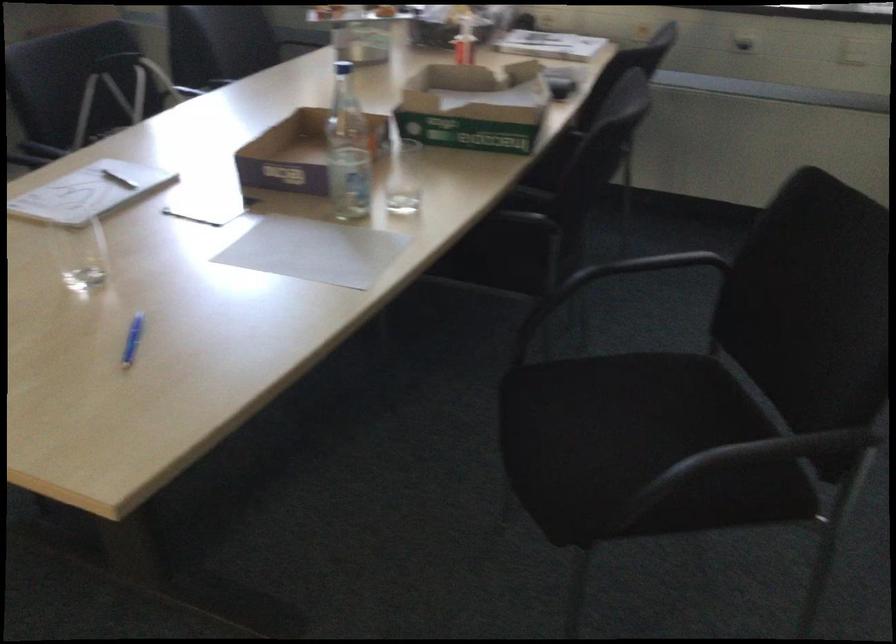
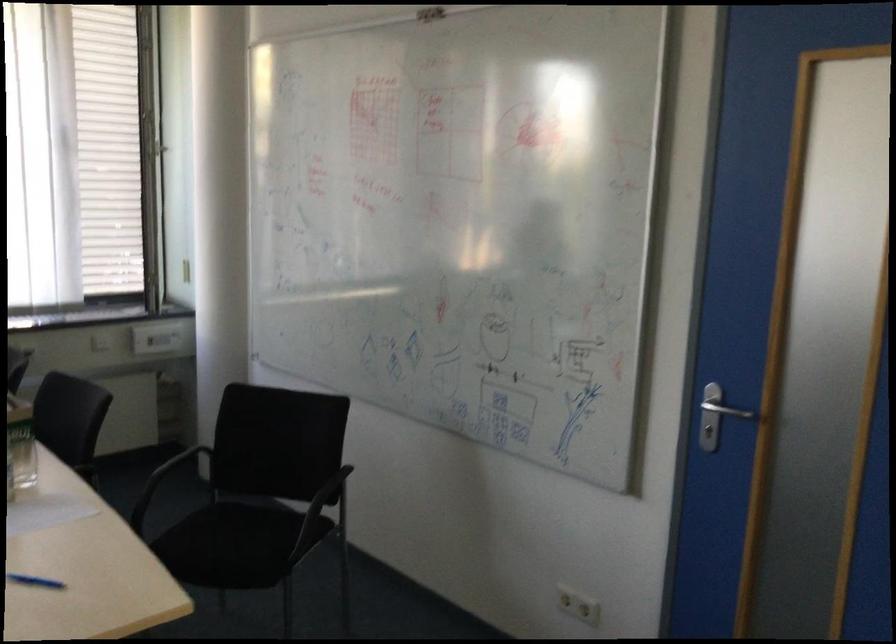
Find the pixel in the second image that matches point 479,154 in the first image.

(21, 444)